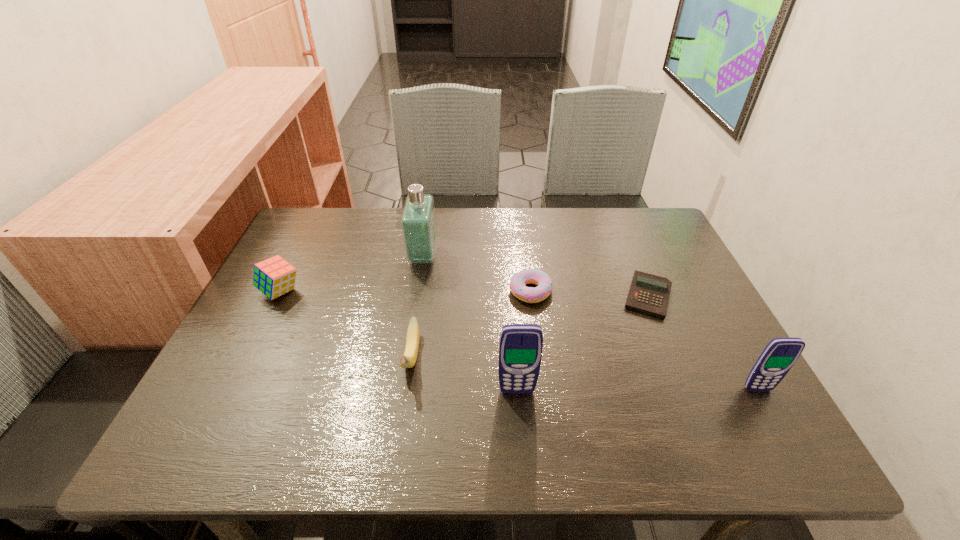
In the current image, all cellular telephones are evenly spaced. To maintain this equal spacing, where should an additional cellular telephone be placed on the left? Please point out a free spot. Please provide its 2D coordinates. Your answer should be formatted as a tuple, i.e. [(x, y)], where the tuple contains the x and y coordinates of a point satisfying the conditions above.

[(275, 393)]